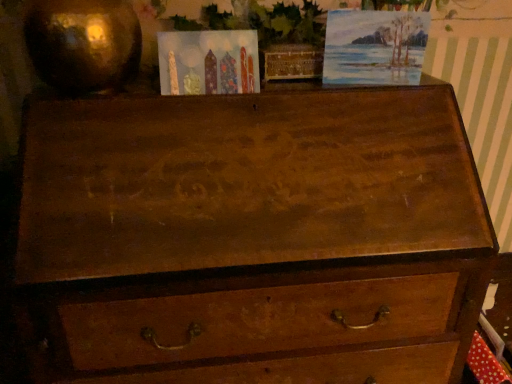
The width and height of the screenshot is (512, 384). In order to click on free area in between matte paper postcard at upper center and watercolor paper painting at upper right in this screenshot , I will do `click(308, 87)`.